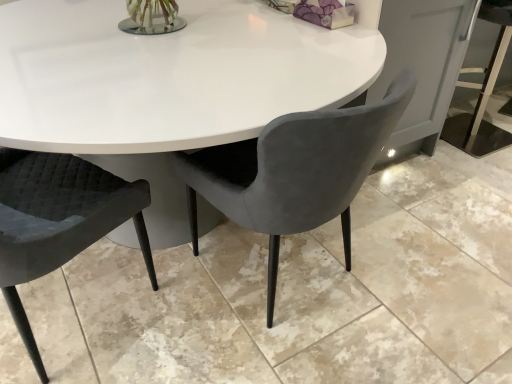
Where is `vacant space to the right of quilted black chair at lower left, the 1th chair when ordered from left to right`? vacant space to the right of quilted black chair at lower left, the 1th chair when ordered from left to right is located at coordinates (179, 322).